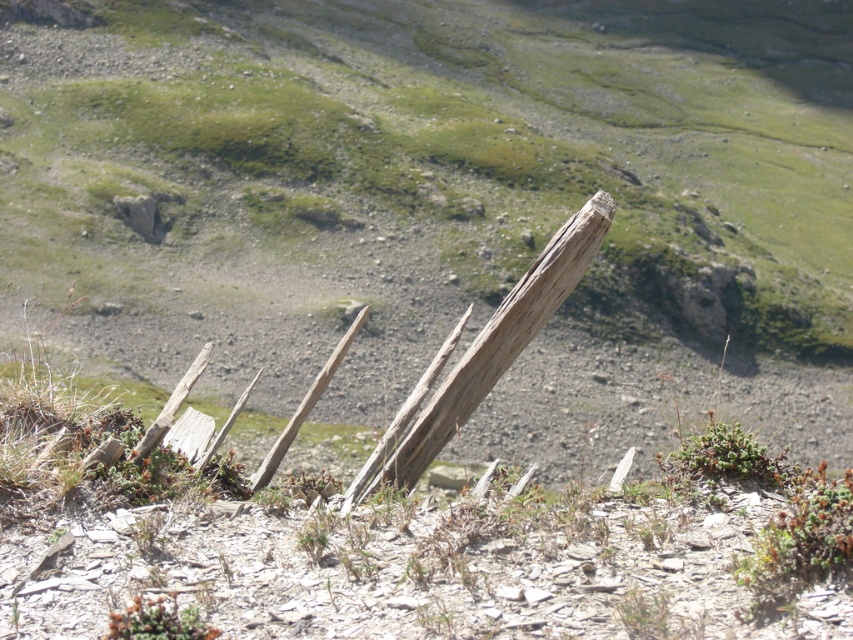
You are a hiker who has spotted two green leafy plants in the rugged landscape. The plants are labeled as the green leafy plant at lower right and the green leafy plant at lower left. Which of these two plants is taller?

The green leafy plant at lower right is taller than the green leafy plant at lower left according to the description.

You are standing at the center of the mountainous landscape and see the point marked at coordinate (729, 456). What object is located at that point?

The point at coordinate (729, 456) indicates a green leafy plant at lower right.

You are a hiker standing at the base of the mountain looking at the rugged landscape. You see two points marked in the image. Which point is closer to you, point (x=761, y=481) or point (x=160, y=611)?

Point (x=160, y=611) is closer to you because it is less further to the camera than point (x=761, y=481).